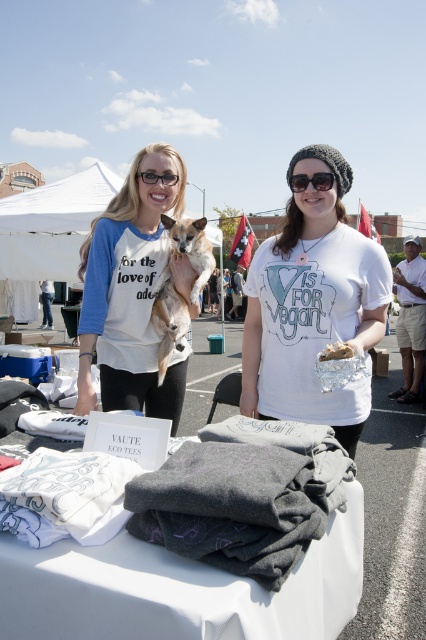
Question: Estimate the real-world distances between objects in this image. Which object is farther from the white matte t-shirt at center?

Choices:
 (A) white fur dog at center
 (B) clear plastic bag at center
 (C) white fabric shirts at lower center
 (D) white cotton shirt at right

Answer: (D)

Question: Can you confirm if white fabric shirts at lower center is wider than white cotton shirt at right?

Choices:
 (A) yes
 (B) no

Answer: (A)

Question: Based on their relative distances, which object is farther from the clear plastic bag at center?

Choices:
 (A) white fur dog at center
 (B) clear plastic glasses at upper center
 (C) white cotton t-shirt at center
 (D) white cotton shirt at right

Answer: (D)

Question: From the image, what is the correct spatial relationship of white cotton t-shirt at center in relation to white fur dog at center?

Choices:
 (A) below
 (B) above

Answer: (A)

Question: Does white fur dog at center have a larger size compared to white cotton shirt at right?

Choices:
 (A) yes
 (B) no

Answer: (B)

Question: Which point is closer to the camera?

Choices:
 (A) white matte t-shirt at center
 (B) clear plastic bag at center
 (C) clear plastic glasses at upper center
 (D) white cotton shirt at right

Answer: (B)